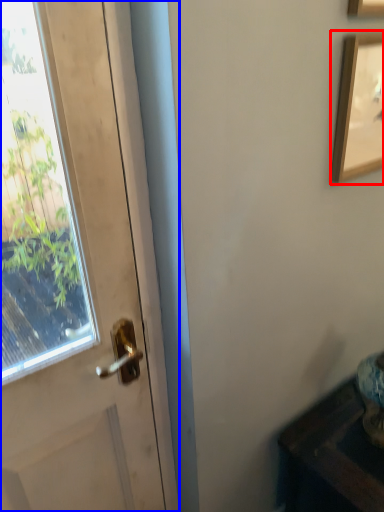
Question: Which object appears farthest to the camera in this image, picture frame (highlighted by a red box) or door (highlighted by a blue box)?

Choices:
 (A) picture frame
 (B) door

Answer: (A)